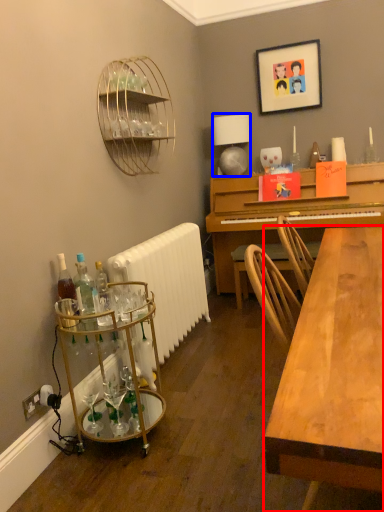
Question: Which object appears closest to the camera in this image, desk (highlighted by a red box) or lamp (highlighted by a blue box)?

Choices:
 (A) desk
 (B) lamp

Answer: (A)